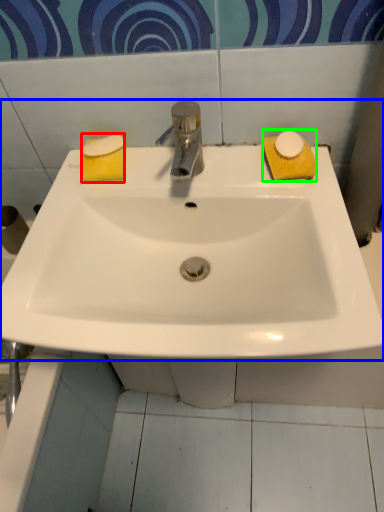
Question: Which object is the farthest from soap (highlighted by a red box)? Choose among these: sink (highlighted by a blue box) or soap (highlighted by a green box).

Choices:
 (A) sink
 (B) soap

Answer: (B)